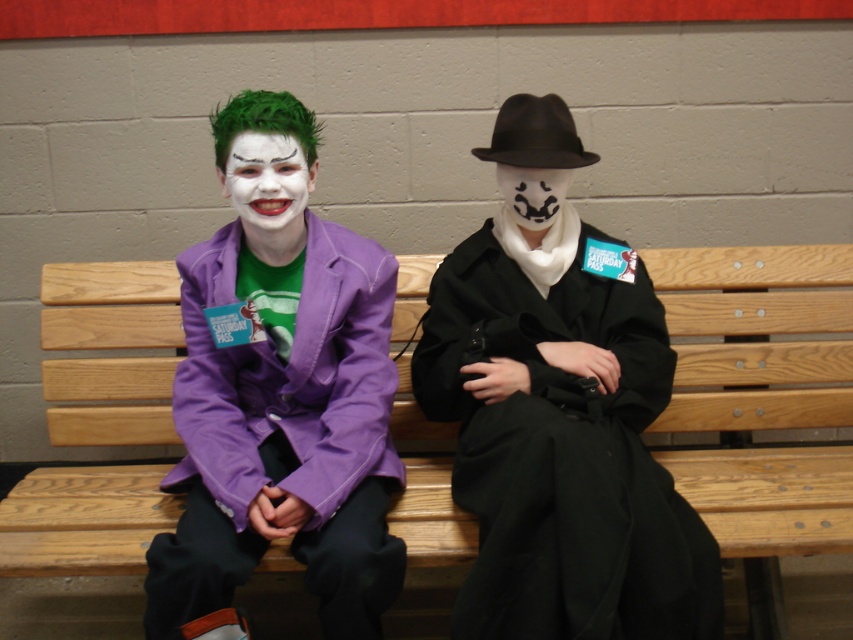
Between matte purple jacket at center and black matte coat at center, which one has more height?

With more height is matte purple jacket at center.

From the picture: Who is lower down, matte purple jacket at center or black matte coat at center?

black matte coat at center is below.

Between point (323, 490) and point (567, 579), which one is positioned in front?

Point (567, 579) is more forward.

Find the location of a particular element. Image resolution: width=853 pixels, height=640 pixels. matte purple jacket at center is located at coordinates (280, 392).

The height and width of the screenshot is (640, 853). What do you see at coordinates (561, 440) in the screenshot?
I see `purple matte jacket at left` at bounding box center [561, 440].

Does purple matte jacket at left lie behind black matte coat at center?

Yes, purple matte jacket at left is behind black matte coat at center.

Describe the element at coordinates (561, 440) in the screenshot. I see `purple matte jacket at left` at that location.

Locate an element on the screen. This screenshot has height=640, width=853. purple matte jacket at left is located at coordinates (561, 440).

Is black matte coat at center smaller than white matte mask at center?

No, black matte coat at center is not smaller than white matte mask at center.

Which is behind, point (456, 477) or point (547, 177)?

Point (547, 177)

Is point (480, 506) positioned behind point (502, 173)?

No, it is in front of (502, 173).

You are a GUI agent. You are given a task and a screenshot of the screen. Output one action in this format:
    pyautogui.click(x=<x>, y=<y>)
    Task: Click on the black matte coat at center
    This screenshot has height=640, width=853.
    Given the screenshot: What is the action you would take?
    pyautogui.click(x=563, y=456)